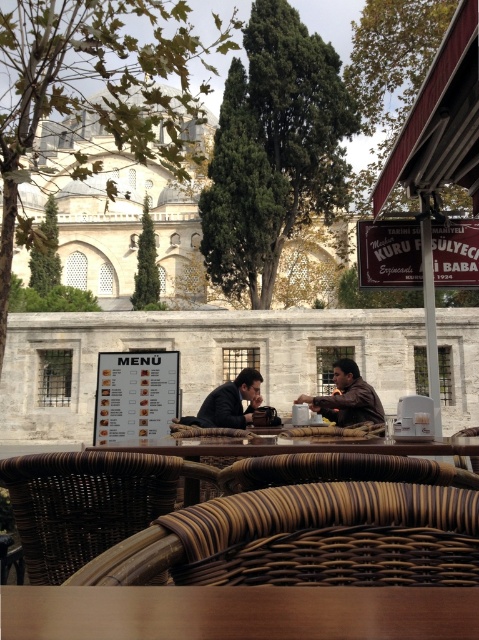
Looking at this image, you are standing at the point with coordinates point [444,588] and want to walk towards the point [431,449]. Which direction should you move?

You should move backward because point [444,588] is in front of point [431,449].

You are a tailor observing the two individuals at the outdoor cafe. You need to determine which clothing item requires more fabric to make between the matte black clothing at center and the brown leather jacket at center. Which one would you choose?

The brown leather jacket at center requires more fabric since it is taller than the matte black clothing at center.